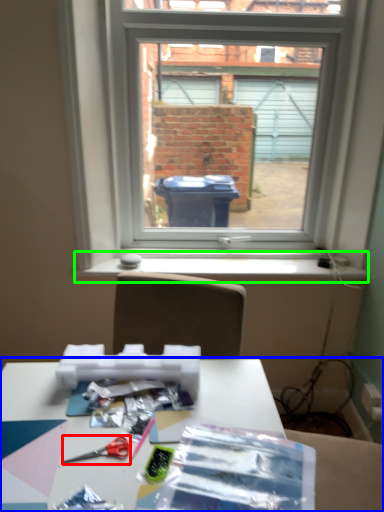
Question: Which is farther away from scissors (highlighted by a red box)? table (highlighted by a blue box) or window sill (highlighted by a green box)?

Choices:
 (A) table
 (B) window sill

Answer: (B)